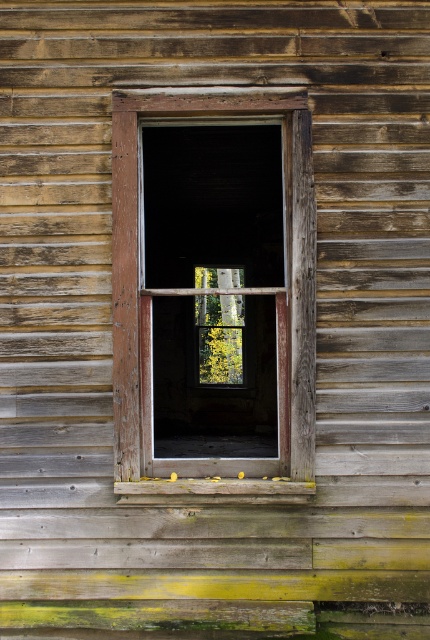
Question: Can you confirm if weathered wood window frame at center is positioned above weathered wood at lower center?

Choices:
 (A) yes
 (B) no

Answer: (A)

Question: Which point appears closest to the camera in this image?

Choices:
 (A) (114, 428)
 (B) (197, 499)

Answer: (A)

Question: Which of the following is the closest to the observer?

Choices:
 (A) weathered wood window frame at center
 (B) weathered wood at lower center

Answer: (A)

Question: Is weathered wood window frame at center to the right of weathered wood at lower center from the viewer's perspective?

Choices:
 (A) yes
 (B) no

Answer: (B)

Question: Is weathered wood window frame at center smaller than weathered wood at lower center?

Choices:
 (A) yes
 (B) no

Answer: (B)